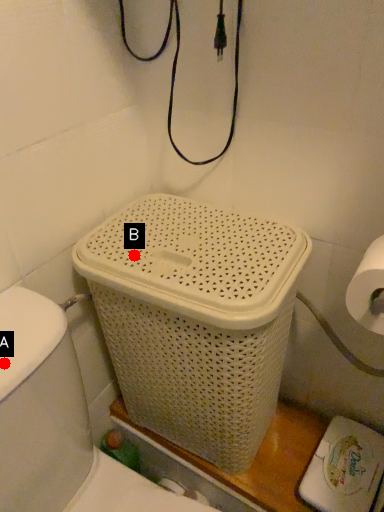
Question: Two points are circled on the image, labeled by A and B beside each circle. Which point is farther from the camera taking this photo?

Choices:
 (A) A is further
 (B) B is further

Answer: (B)